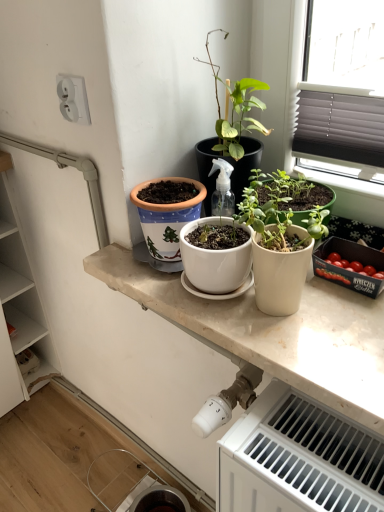
I want to click on vacant area located to the right-hand side of white matte pot at center, so click(x=349, y=302).